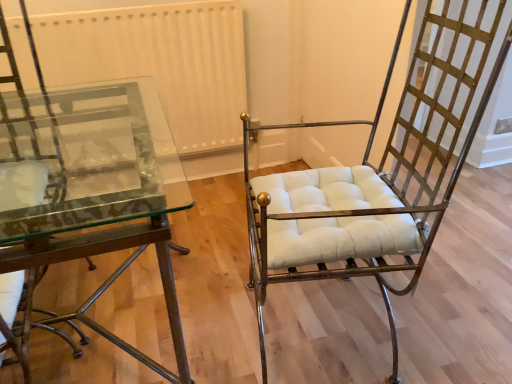
Question: Considering the relative sizes of clear glass table at left and metallic glass table at left, which appears as the second chair when viewed from the right, in the image provided, is clear glass table at left taller than metallic glass table at left, which appears as the second chair when viewed from the right,?

Choices:
 (A) no
 (B) yes

Answer: (A)

Question: Can you confirm if clear glass table at left is thinner than metallic glass table at left, acting as the 1th chair starting from the left?

Choices:
 (A) no
 (B) yes

Answer: (A)

Question: Can you confirm if clear glass table at left is shorter than metallic glass table at left, acting as the 1th chair starting from the left?

Choices:
 (A) no
 (B) yes

Answer: (B)

Question: Is clear glass table at left completely or partially outside of metallic glass table at left, acting as the 1th chair starting from the left?

Choices:
 (A) yes
 (B) no

Answer: (A)

Question: Does clear glass table at left contain metallic glass table at left, which appears as the second chair when viewed from the right?

Choices:
 (A) no
 (B) yes

Answer: (B)

Question: Is point (24, 337) positioned closer to the camera than point (131, 139)?

Choices:
 (A) closer
 (B) farther

Answer: (A)

Question: Is metallic glass table at left, which appears as the second chair when viewed from the right, inside the boundaries of clear glass table at left, or outside?

Choices:
 (A) inside
 (B) outside

Answer: (A)

Question: Is metallic glass table at left, which appears as the second chair when viewed from the right, in front of or behind clear glass table at left in the image?

Choices:
 (A) behind
 (B) front

Answer: (B)

Question: From a real-world perspective, is metallic glass table at left, which appears as the second chair when viewed from the right, physically located above or below clear glass table at left?

Choices:
 (A) below
 (B) above

Answer: (B)

Question: Looking at the image, does clear glass table at left seem bigger or smaller compared to metallic glass table at left, which appears as the second chair when viewed from the right?

Choices:
 (A) small
 (B) big

Answer: (B)

Question: Is clear glass table at left taller or shorter than metallic glass table at left, which appears as the second chair when viewed from the right?

Choices:
 (A) short
 (B) tall

Answer: (A)

Question: From the image's perspective, is clear glass table at left above or below metallic glass table at left, which appears as the second chair when viewed from the right?

Choices:
 (A) below
 (B) above

Answer: (B)

Question: Is point (104, 288) positioned closer to the camera than point (23, 167)?

Choices:
 (A) farther
 (B) closer

Answer: (A)

Question: From the image's perspective, is gold textured metal chair at right, the first chair when ordered from right to left, above or below white textured radiator at upper center?

Choices:
 (A) above
 (B) below

Answer: (B)

Question: In the image, is gold textured metal chair at right, placed as the 2th chair when sorted from left to right, positioned in front of or behind white textured radiator at upper center?

Choices:
 (A) behind
 (B) front

Answer: (B)